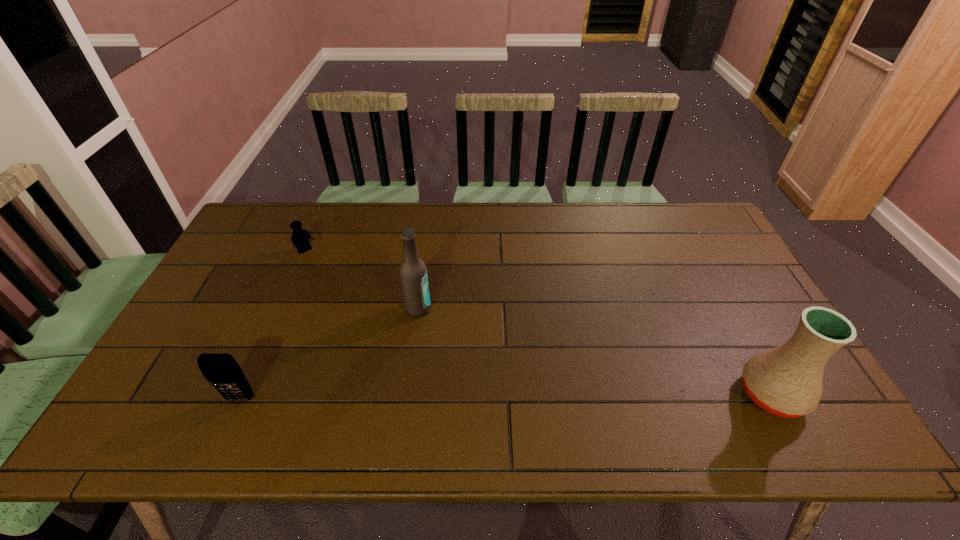
Locate an element on the screen. This screenshot has width=960, height=540. unoccupied position between the rightmost object and the cellular telephone is located at coordinates (x=506, y=396).

You are a GUI agent. You are given a task and a screenshot of the screen. Output one action in this format:
    pyautogui.click(x=<x>, y=<y>)
    Task: Click on the blank region between the second shortest object and the beer bottle
    
    Given the screenshot: What is the action you would take?
    pyautogui.click(x=329, y=354)

In order to click on object that is the third closest to the farthest object in this screenshot , I will do `click(786, 381)`.

Where is `object that is the second closest to the cellular telephone`? The height and width of the screenshot is (540, 960). object that is the second closest to the cellular telephone is located at coordinates (300, 236).